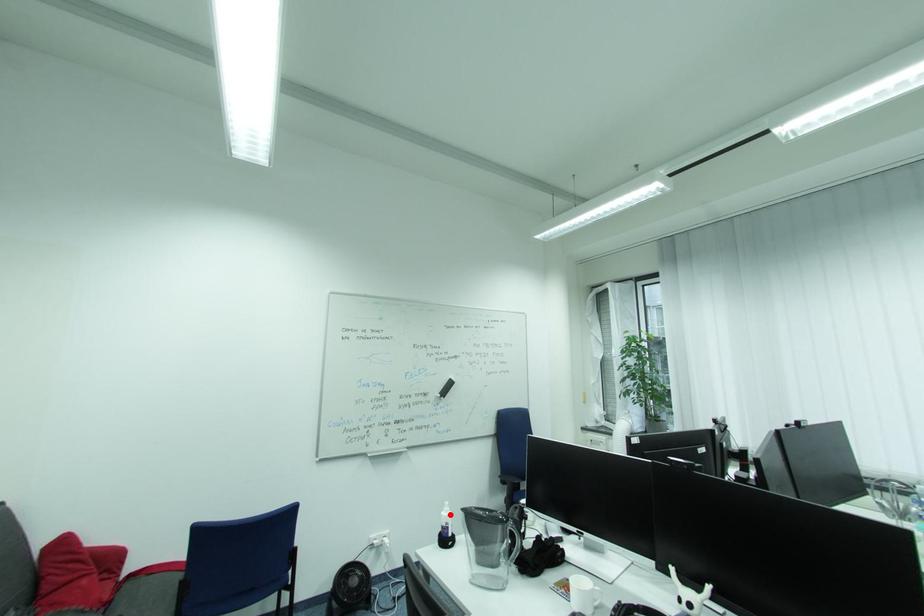
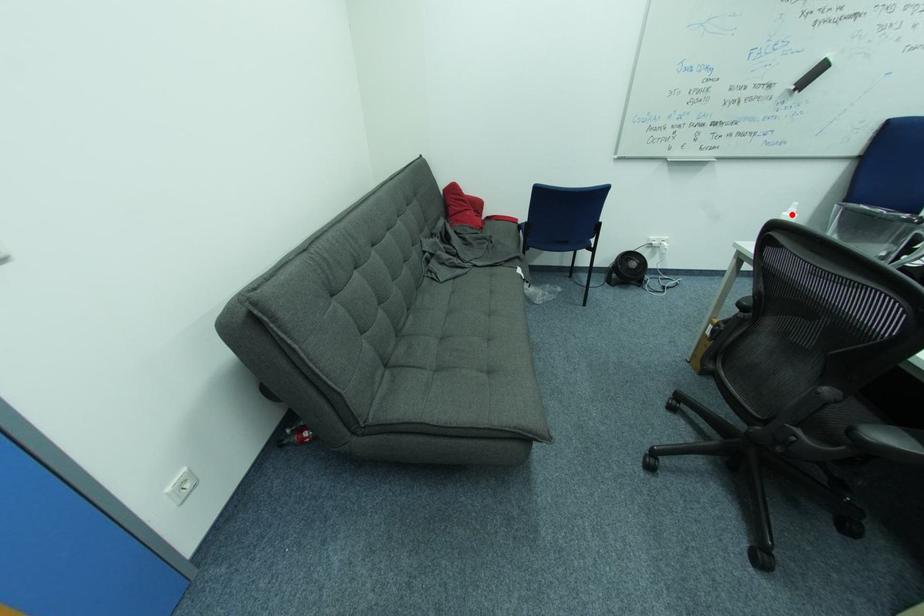
I am providing you with two images of the same scene from different viewpoints. A red point is marked on the first image and another point is marked on the second image. Do the highlighted points in image1 and image2 indicate the same real-world spot?

Yes